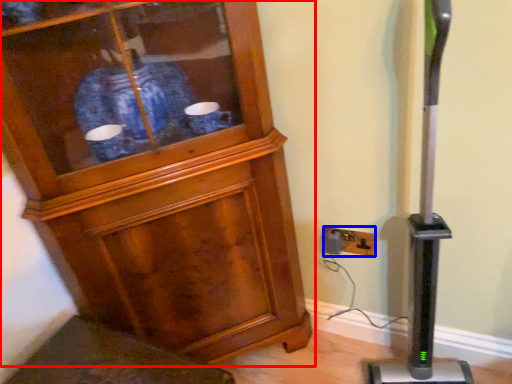
Question: Which object is further to the camera taking this photo, cupboard (highlighted by a red box) or electric outlet (highlighted by a blue box)?

Choices:
 (A) cupboard
 (B) electric outlet

Answer: (B)